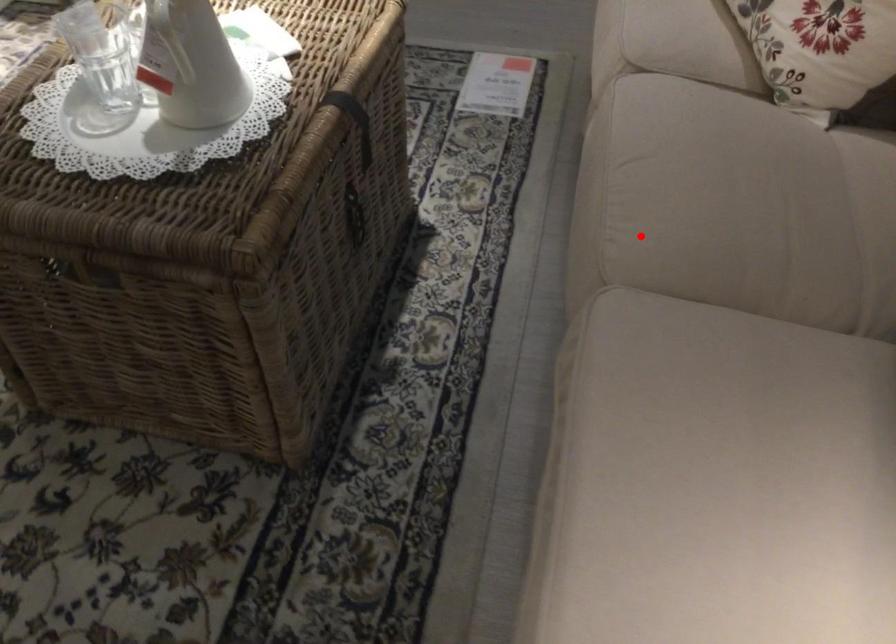
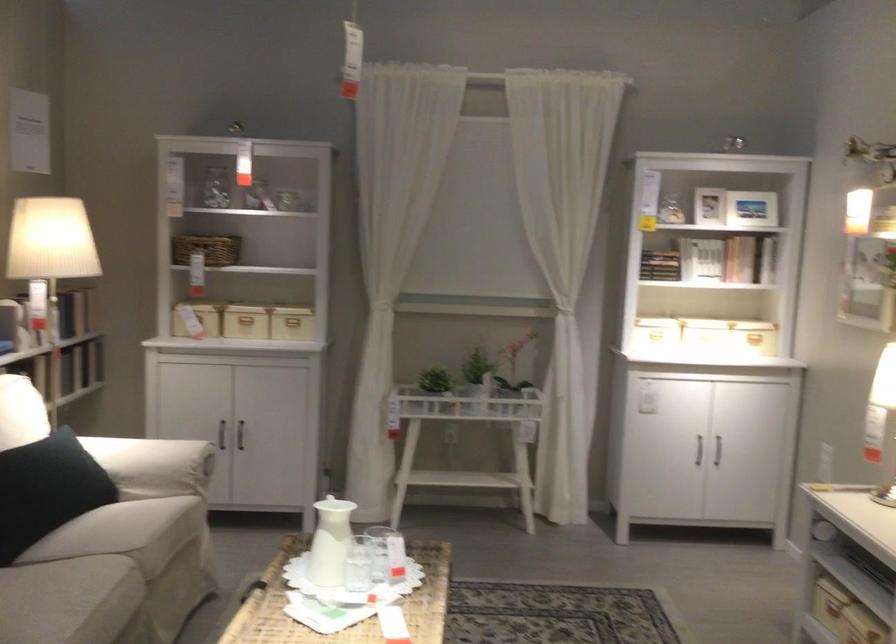
The point at the highlighted location is marked in the first image. Where is the corresponding point in the second image?

(110, 576)